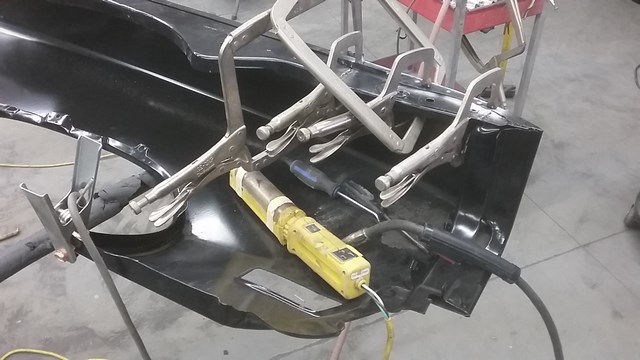
Find the location of a particular element. Image resolution: width=640 pixels, height=360 pixels. red shelf is located at coordinates (475, 18).